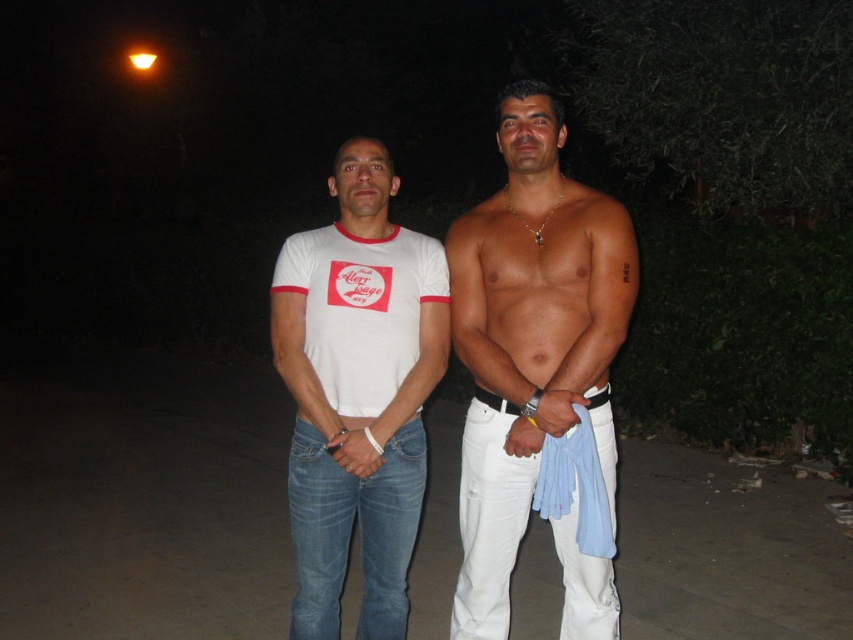
Question: Is white cotton t-shirt at center to the left of black leather belt at center from the viewer's perspective?

Choices:
 (A) no
 (B) yes

Answer: (B)

Question: Which point is closer to the camera taking this photo?

Choices:
 (A) (341, 305)
 (B) (605, 396)
 (C) (592, 200)

Answer: (B)

Question: Can you confirm if smooth white pants at center is thinner than black leather belt at center?

Choices:
 (A) yes
 (B) no

Answer: (B)

Question: Among these objects, which one is farthest from the camera?

Choices:
 (A) smooth white pants at center
 (B) white ringer t-shirt at center
 (C) black leather belt at center
 (D) white cotton t-shirt at center

Answer: (B)

Question: Can you confirm if white cotton t-shirt at center is positioned below white ringer t-shirt at center?

Choices:
 (A) yes
 (B) no

Answer: (A)

Question: Which object appears closest to the camera in this image?

Choices:
 (A) white ringer t-shirt at center
 (B) white cotton t-shirt at center

Answer: (B)